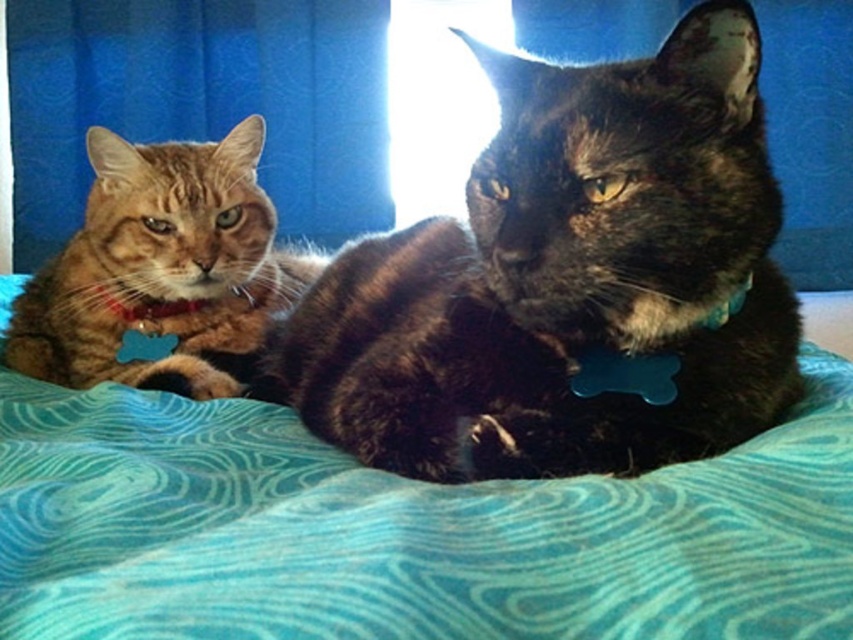
You are standing in a room with a bed covered in a teal blanket and two cats. You notice a point marked at coordinates (201, 102). What object in the scene corresponds to this coordinate?

The point at coordinates (201, 102) corresponds to the matte blue curtain at left.

You are a photographer trying to capture a closeup of the teal fabric blanket at center. Based on the scene description, what is the minimum distance you need to be from the blanket to focus properly?

The teal fabric blanket at center is 10.32 inches away from the camera, so the minimum focusing distance should be at least 10.32 inches to capture it clearly.